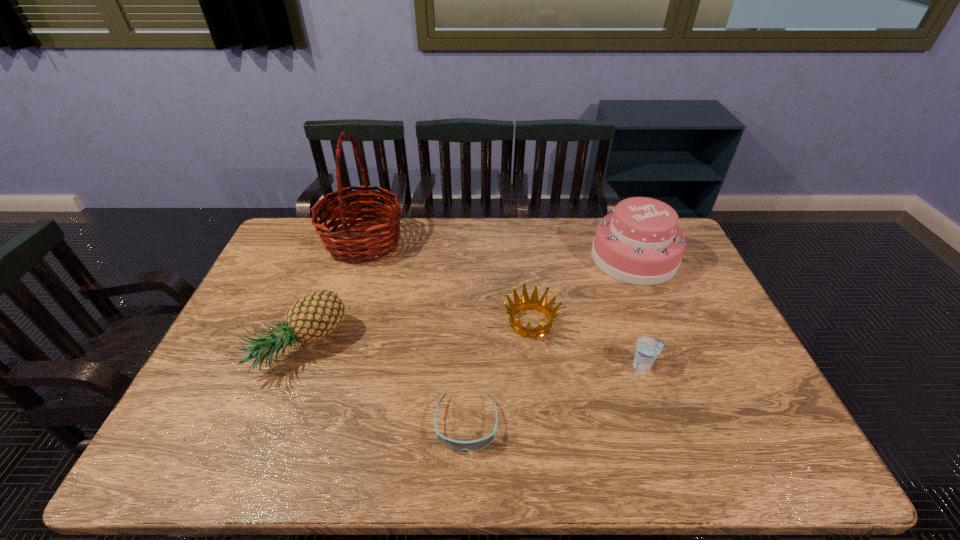
Image resolution: width=960 pixels, height=540 pixels. What are the coordinates of `vacant area between the second tallest object and the basket` in the screenshot? It's located at (498, 250).

You are a GUI agent. You are given a task and a screenshot of the screen. Output one action in this format:
    pyautogui.click(x=<x>, y=<y>)
    Task: Click on the free spot between the cake and the basket
    This screenshot has height=540, width=960.
    Given the screenshot: What is the action you would take?
    pyautogui.click(x=498, y=250)

Where is `vacant area between the cake and the fourth shortest object`? The height and width of the screenshot is (540, 960). vacant area between the cake and the fourth shortest object is located at coordinates (467, 303).

Locate an element on the screen. empty location between the fourth object from right to left and the fourth object from left to right is located at coordinates (498, 373).

Identify which object is the fourth nearest to the fifth shortest object. Please provide its 2D coordinates. Your answer should be formatted as a tuple, i.e. [(x, y)], where the tuple contains the x and y coordinates of a point satisfying the conditions above.

[(373, 243)]

I want to click on object identified as the fourth closest to the yogurt, so click(x=373, y=243).

In order to click on free region that satisfies the following two spatial constraints: 1. on the handle side of the yogurt; 2. on the left side of the tallest object in this screenshot , I will do `click(324, 365)`.

Where is `free space that satisfies the following two spatial constraints: 1. on the back side of the fifth shortest object; 2. on the handle side of the tallest object`? Image resolution: width=960 pixels, height=540 pixels. free space that satisfies the following two spatial constraints: 1. on the back side of the fifth shortest object; 2. on the handle side of the tallest object is located at coordinates (627, 242).